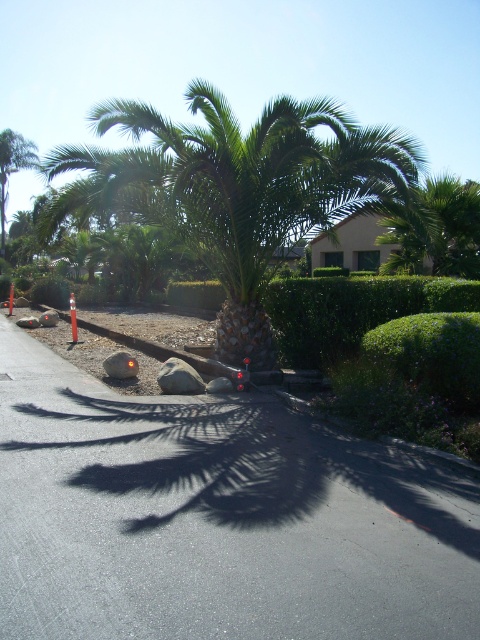
Question: Is the position of green leafy palm tree at center more distant than that of gray rock at center?

Choices:
 (A) yes
 (B) no

Answer: (B)

Question: Is asphalt at center positioned at the back of gray rock at center?

Choices:
 (A) yes
 (B) no

Answer: (B)

Question: Which point is farther to the camera?

Choices:
 (A) (264, 120)
 (B) (173, 360)

Answer: (B)

Question: Is asphalt at center smaller than gray rough rock at center?

Choices:
 (A) no
 (B) yes

Answer: (B)

Question: Which object is the closest to the gray rough rock at center?

Choices:
 (A) green leafy palm tree at center
 (B) gray rock at center
 (C) asphalt at center
 (D) green leafy palm tree at left

Answer: (B)

Question: Which point is closer to the camera taking this photo?

Choices:
 (A) coord(152,529)
 (B) coord(183,381)
 (C) coord(26,164)
 (D) coord(347,196)

Answer: (A)